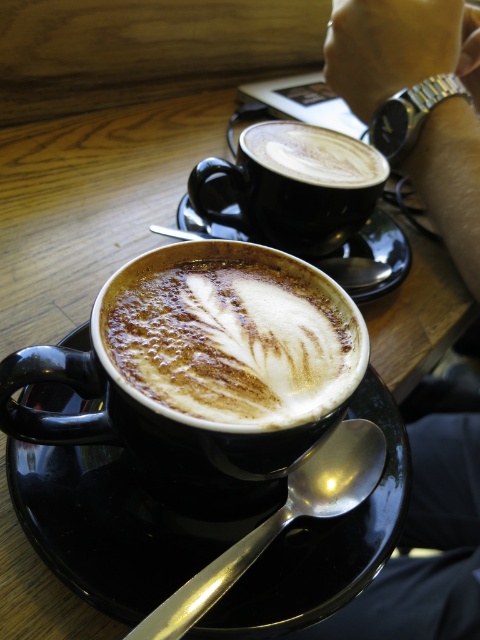
Which is more to the left, black ceramic saucer at center or black matte saucer at center?

black ceramic saucer at center

Who is more forward, (250, 632) or (368, 225)?

Point (250, 632) is in front.

You are a GUI agent. You are given a task and a screenshot of the screen. Output one action in this format:
    pyautogui.click(x=<x>, y=<y>)
    Task: Click on the black ceramic saucer at center
    Image resolution: width=480 pixels, height=640 pixels.
    Given the screenshot: What is the action you would take?
    pyautogui.click(x=126, y=522)

Does black ceramic saucer at center come behind silver metallic spoon at lower center?

Yes.

Between black ceramic saucer at center and silver metallic spoon at lower center, which one is positioned lower?

Positioned lower is silver metallic spoon at lower center.

Identify the location of black ceramic saucer at center. This screenshot has width=480, height=640. (126, 522).

Locate an element on the screen. black ceramic saucer at center is located at coordinates (126, 522).

Between black ceramic saucer at center and matte black coffee cup at center, which one is positioned lower?

black ceramic saucer at center is lower down.

Between point (188, 522) and point (243, 349), which one is positioned behind?

Positioned behind is point (188, 522).

At what (x,y) coordinates should I click in order to perform the action: click on black ceramic saucer at center. Please return your answer as a coordinate pair (x, y). Looking at the image, I should click on (126, 522).